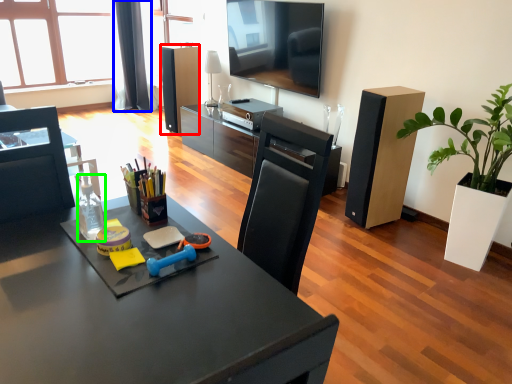
Question: Based on their relative distances, which object is farther from speaker (highlighted by a red box)? Choose from curtain (highlighted by a blue box) and bottle (highlighted by a green box).

Choices:
 (A) curtain
 (B) bottle

Answer: (B)